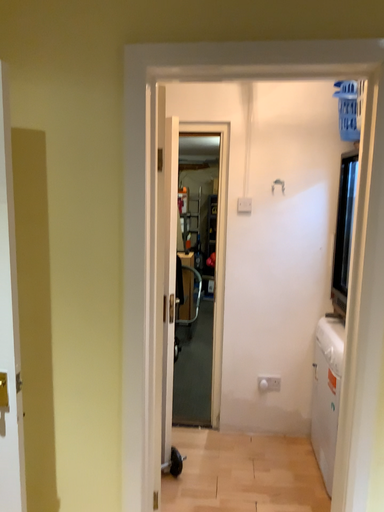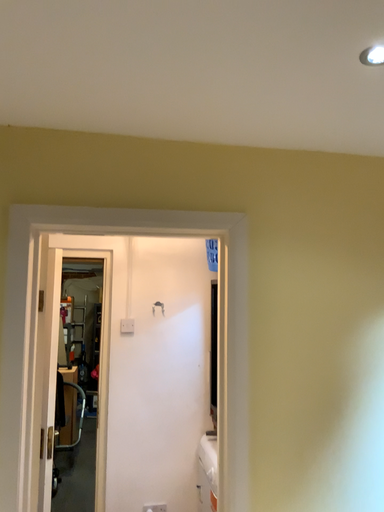
Question: Which way did the camera rotate in the video?

Choices:
 (A) rotated left
 (B) rotated right

Answer: (B)